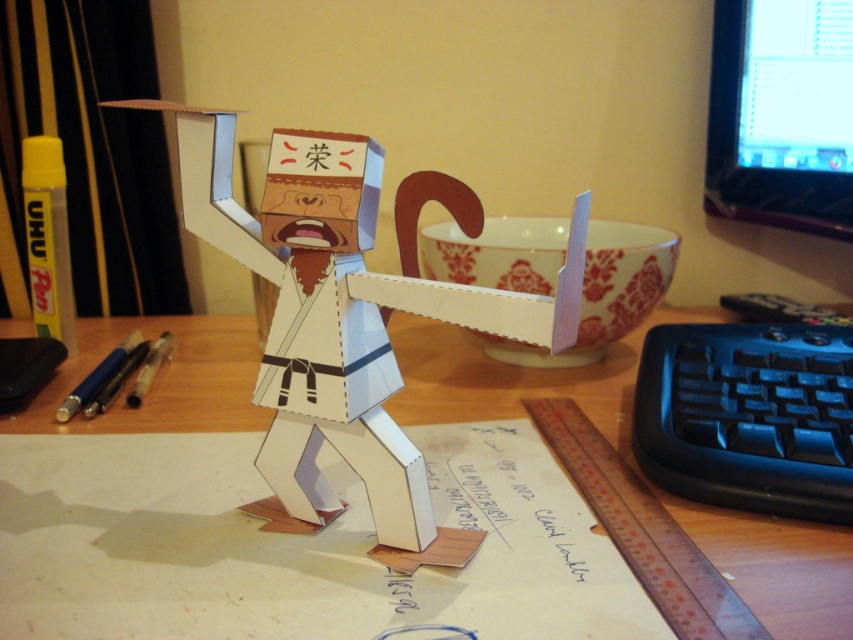
Which is more to the left, cardboard paper doll at center or wooden desk at center?

cardboard paper doll at center is more to the left.

Is cardboard paper doll at center wider than wooden desk at center?

No, cardboard paper doll at center is not wider than wooden desk at center.

Which is in front, point (183, 164) or point (772, 593)?

Point (772, 593) is more forward.

Find the location of a particular element. The width and height of the screenshot is (853, 640). cardboard paper doll at center is located at coordinates (345, 321).

Who is lower down, wooden desk at center or black plastic keyboard at lower right?

black plastic keyboard at lower right is below.

Where is `wooden desk at center`? wooden desk at center is located at coordinates (636, 465).

Locate an element on the screen. The width and height of the screenshot is (853, 640). wooden desk at center is located at coordinates (636, 465).

Is cardboard paper doll at center bigger than black glossy monitor at upper right?

Correct, cardboard paper doll at center is larger in size than black glossy monitor at upper right.

Between cardboard paper doll at center and black glossy monitor at upper right, which one appears on the left side from the viewer's perspective?

Positioned to the left is cardboard paper doll at center.

The height and width of the screenshot is (640, 853). What do you see at coordinates (345, 321) in the screenshot? I see `cardboard paper doll at center` at bounding box center [345, 321].

Find the location of a particular element. The height and width of the screenshot is (640, 853). cardboard paper doll at center is located at coordinates (345, 321).